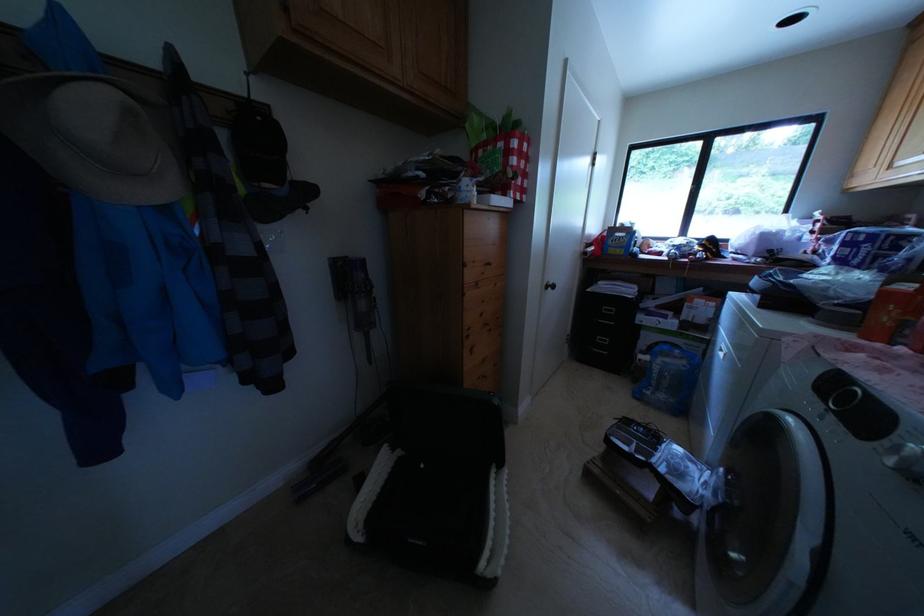
At what (x,y) coordinates should I click in order to perform the action: click on blue jug handle. Please return your answer as a coordinate pair (x, y). This screenshot has height=616, width=924. Looking at the image, I should click on (664, 342).